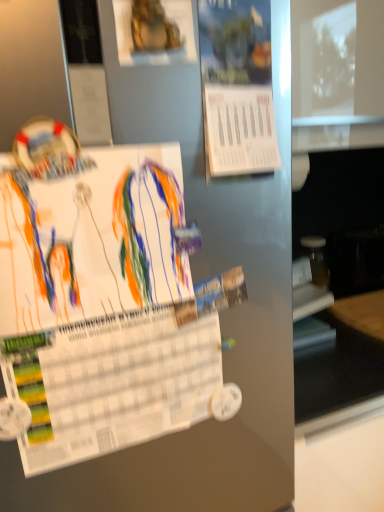
This screenshot has height=512, width=384. What do you see at coordinates (237, 86) in the screenshot?
I see `blue paper at upper center, which appears as the 2th poster when viewed from the top` at bounding box center [237, 86].

I want to click on blue paper at upper center, marked as the 2th poster in a bottom-to-top arrangement, so click(237, 86).

How many degrees apart are the facing directions of white paper at center, the 1th poster when ordered from bottom to top, and gold metallic statue at upper center, the 1th poster positioned from the top?

The facing directions of white paper at center, the 1th poster when ordered from bottom to top, and gold metallic statue at upper center, the 1th poster positioned from the top, are 0.00579 degrees apart.

Is point (161, 343) closer or farther from the camera than point (164, 38)?

Point (161, 343) appears to be farther away from the viewer than point (164, 38).

Which object is closer to the camera taking this photo, white paper at center, positioned as the 3th poster in top-to-bottom order, or gold metallic statue at upper center, marked as the third poster in a bottom-to-top arrangement?

Positioned in front is white paper at center, positioned as the 3th poster in top-to-bottom order.

Can you see white paper at center, positioned as the 3th poster in top-to-bottom order, touching gold metallic statue at upper center, marked as the third poster in a bottom-to-top arrangement?

There is a gap between white paper at center, positioned as the 3th poster in top-to-bottom order, and gold metallic statue at upper center, marked as the third poster in a bottom-to-top arrangement.

Is gold metallic statue at upper center, marked as the third poster in a bottom-to-top arrangement, located outside white paper at center, positioned as the 3th poster in top-to-bottom order?

gold metallic statue at upper center, marked as the third poster in a bottom-to-top arrangement, is positioned outside white paper at center, positioned as the 3th poster in top-to-bottom order.

From a real-world perspective, relative to white paper at center, the 1th poster when ordered from bottom to top, is gold metallic statue at upper center, the 1th poster positioned from the top, vertically above or below?

In terms of real-world spatial position, gold metallic statue at upper center, the 1th poster positioned from the top, is above white paper at center, the 1th poster when ordered from bottom to top.

There is a gold metallic statue at upper center, the 1th poster positioned from the top. Where is `the 2nd poster below it (from the image's perspective)`? the 2nd poster below it (from the image's perspective) is located at coordinates (106, 306).

How far apart are gold metallic statue at upper center, marked as the third poster in a bottom-to-top arrangement, and white paper at center, positioned as the 3th poster in top-to-bottom order?

They are 11.69 inches apart.

Which point is more forward, (x=124, y=48) or (x=202, y=57)?

Point (x=124, y=48)

Can you confirm if gold metallic statue at upper center, the 1th poster positioned from the top, is smaller than blue paper at upper center, marked as the 2th poster in a bottom-to-top arrangement?

Yes, gold metallic statue at upper center, the 1th poster positioned from the top, is smaller than blue paper at upper center, marked as the 2th poster in a bottom-to-top arrangement.

From the image's perspective, is gold metallic statue at upper center, marked as the third poster in a bottom-to-top arrangement, located beneath blue paper at upper center, marked as the 2th poster in a bottom-to-top arrangement?

No, from the image's perspective, gold metallic statue at upper center, marked as the third poster in a bottom-to-top arrangement, is not below blue paper at upper center, marked as the 2th poster in a bottom-to-top arrangement.

Is blue paper at upper center, which appears as the 2th poster when viewed from the top, far away from white paper at center, positioned as the 3th poster in top-to-bottom order?

Actually, blue paper at upper center, which appears as the 2th poster when viewed from the top, and white paper at center, positioned as the 3th poster in top-to-bottom order, are a little close together.

Can you tell me how much blue paper at upper center, which appears as the 2th poster when viewed from the top, and white paper at center, the 1th poster when ordered from bottom to top, differ in facing direction?

blue paper at upper center, which appears as the 2th poster when viewed from the top, and white paper at center, the 1th poster when ordered from bottom to top, are facing 0.00923 degrees away from each other.

Considering the relative positions of blue paper at upper center, which appears as the 2th poster when viewed from the top, and white paper at center, positioned as the 3th poster in top-to-bottom order, in the image provided, is blue paper at upper center, which appears as the 2th poster when viewed from the top, to the left of white paper at center, positioned as the 3th poster in top-to-bottom order, from the viewer's perspective?

No, blue paper at upper center, which appears as the 2th poster when viewed from the top, is not to the left of white paper at center, positioned as the 3th poster in top-to-bottom order.

Does blue paper at upper center, which appears as the 2th poster when viewed from the top, appear on the left side of gold metallic statue at upper center, marked as the third poster in a bottom-to-top arrangement?

No.

The image size is (384, 512). I want to click on poster lying on the right of gold metallic statue at upper center, marked as the third poster in a bottom-to-top arrangement, so click(x=237, y=86).

Between blue paper at upper center, marked as the 2th poster in a bottom-to-top arrangement, and gold metallic statue at upper center, the 1th poster positioned from the top, which one is positioned behind?

blue paper at upper center, marked as the 2th poster in a bottom-to-top arrangement, is further from the camera.

Considering the points (115, 221) and (210, 75), which point is behind, point (115, 221) or point (210, 75)?

The point (210, 75) is farther from the camera.

From the image's perspective, which is below, white paper at center, positioned as the 3th poster in top-to-bottom order, or blue paper at upper center, which appears as the 2th poster when viewed from the top?

From the image's view, white paper at center, positioned as the 3th poster in top-to-bottom order, is below.

How far apart are white paper at center, positioned as the 3th poster in top-to-bottom order, and blue paper at upper center, which appears as the 2th poster when viewed from the top?

They are 22.66 centimeters apart.

Considering the relative sizes of white paper at center, the 1th poster when ordered from bottom to top, and blue paper at upper center, which appears as the 2th poster when viewed from the top, in the image provided, is white paper at center, the 1th poster when ordered from bottom to top, thinner than blue paper at upper center, which appears as the 2th poster when viewed from the top,?

Correct, the width of white paper at center, the 1th poster when ordered from bottom to top, is less than that of blue paper at upper center, which appears as the 2th poster when viewed from the top.

This screenshot has height=512, width=384. There is a gold metallic statue at upper center, the 1th poster positioned from the top. Identify the location of the 2nd poster below it (from a real-world perspective). point(106,306).

I want to click on the 2nd poster above the white paper at center, the 1th poster when ordered from bottom to top (from the image's perspective), so click(154, 32).

Estimate the real-world distances between objects in this image. Which object is further from blue paper at upper center, which appears as the 2th poster when viewed from the top, gold metallic statue at upper center, marked as the third poster in a bottom-to-top arrangement, or white paper at center, positioned as the 3th poster in top-to-bottom order?

Based on the image, white paper at center, positioned as the 3th poster in top-to-bottom order, appears to be further to blue paper at upper center, which appears as the 2th poster when viewed from the top.

Which object lies further to the anchor point white paper at center, positioned as the 3th poster in top-to-bottom order, blue paper at upper center, marked as the 2th poster in a bottom-to-top arrangement, or gold metallic statue at upper center, the 1th poster positioned from the top?

gold metallic statue at upper center, the 1th poster positioned from the top, is further to white paper at center, positioned as the 3th poster in top-to-bottom order.

Considering their positions, is blue paper at upper center, marked as the 2th poster in a bottom-to-top arrangement, positioned further to gold metallic statue at upper center, marked as the third poster in a bottom-to-top arrangement, than white paper at center, positioned as the 3th poster in top-to-bottom order?

white paper at center, positioned as the 3th poster in top-to-bottom order, lies further to gold metallic statue at upper center, marked as the third poster in a bottom-to-top arrangement, than the other object.

Estimate the real-world distances between objects in this image. Which object is closer to blue paper at upper center, marked as the 2th poster in a bottom-to-top arrangement, white paper at center, the 1th poster when ordered from bottom to top, or gold metallic statue at upper center, the 1th poster positioned from the top?

The object closer to blue paper at upper center, marked as the 2th poster in a bottom-to-top arrangement, is gold metallic statue at upper center, the 1th poster positioned from the top.

Based on their spatial positions, is gold metallic statue at upper center, the 1th poster positioned from the top, or blue paper at upper center, marked as the 2th poster in a bottom-to-top arrangement, further from white paper at center, positioned as the 3th poster in top-to-bottom order?

Among the two, gold metallic statue at upper center, the 1th poster positioned from the top, is located further to white paper at center, positioned as the 3th poster in top-to-bottom order.

From the image, which object appears to be farther from gold metallic statue at upper center, the 1th poster positioned from the top, white paper at center, positioned as the 3th poster in top-to-bottom order, or blue paper at upper center, marked as the 2th poster in a bottom-to-top arrangement?

white paper at center, positioned as the 3th poster in top-to-bottom order.

Locate an element on the screen. The image size is (384, 512). poster that lies between gold metallic statue at upper center, the 1th poster positioned from the top, and white paper at center, the 1th poster when ordered from bottom to top, from top to bottom is located at coordinates (237, 86).